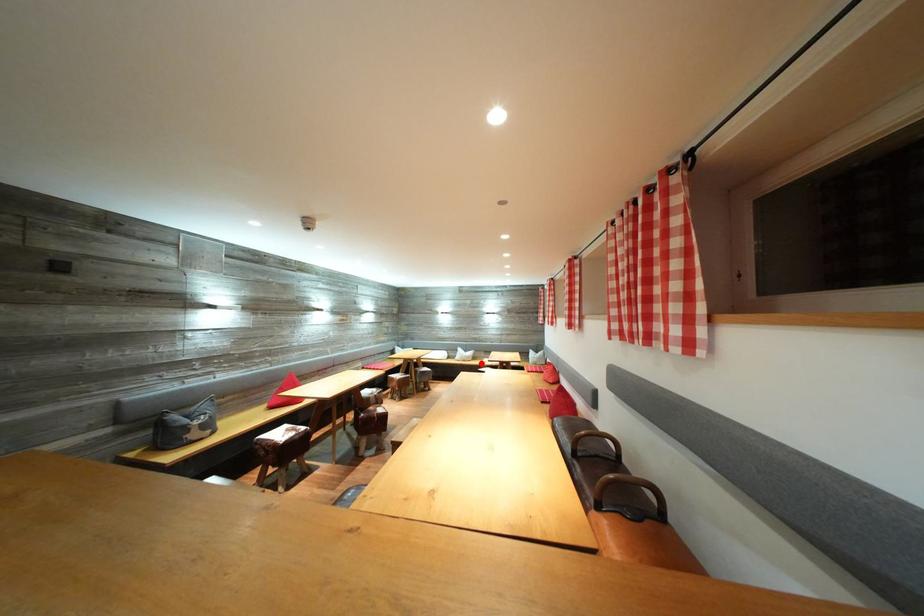
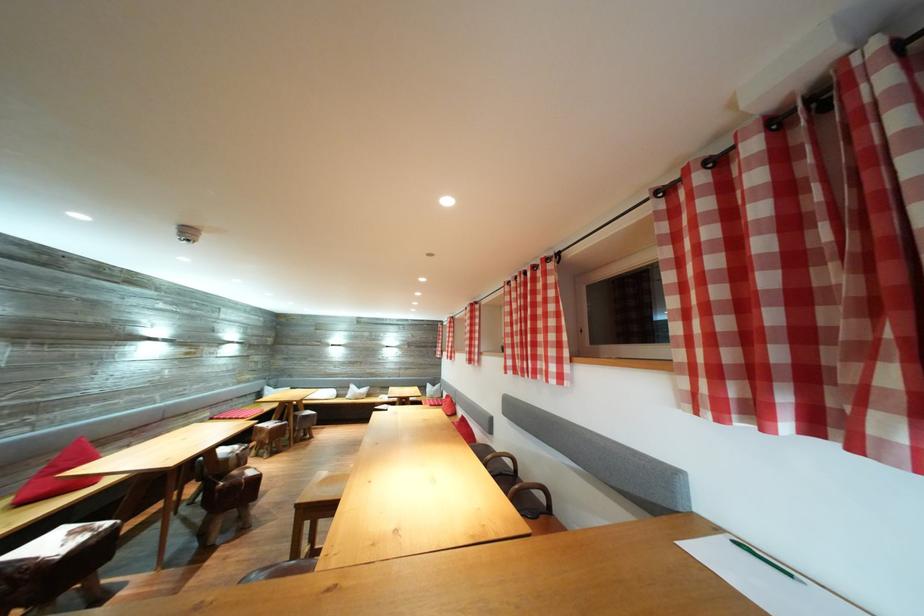
The point at the highlighted location is marked in the first image. Where is the corresponding point in the second image?

(375, 400)